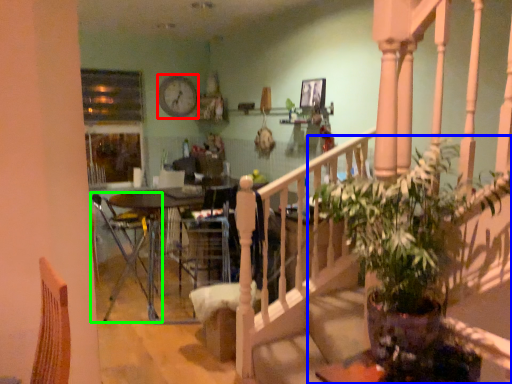
Question: Which is nearer to the clock (highlighted by a red box)? houseplant (highlighted by a blue box) or chair (highlighted by a green box).

Choices:
 (A) houseplant
 (B) chair

Answer: (B)